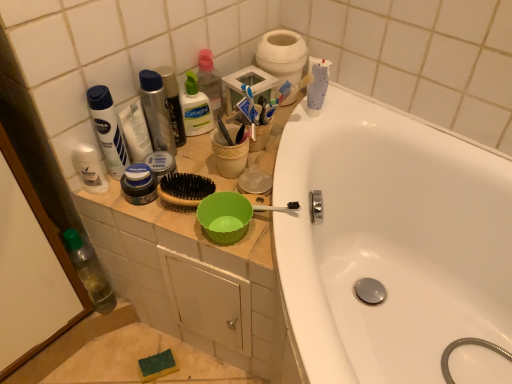
At what (x,y) coordinates should I click in order to perform the action: click on free spot to the right of metallic silver mouthwash at upper center, the 2th mouthwash from the right. Please return your answer as a coordinate pair (x, y). Looking at the image, I should click on (208, 157).